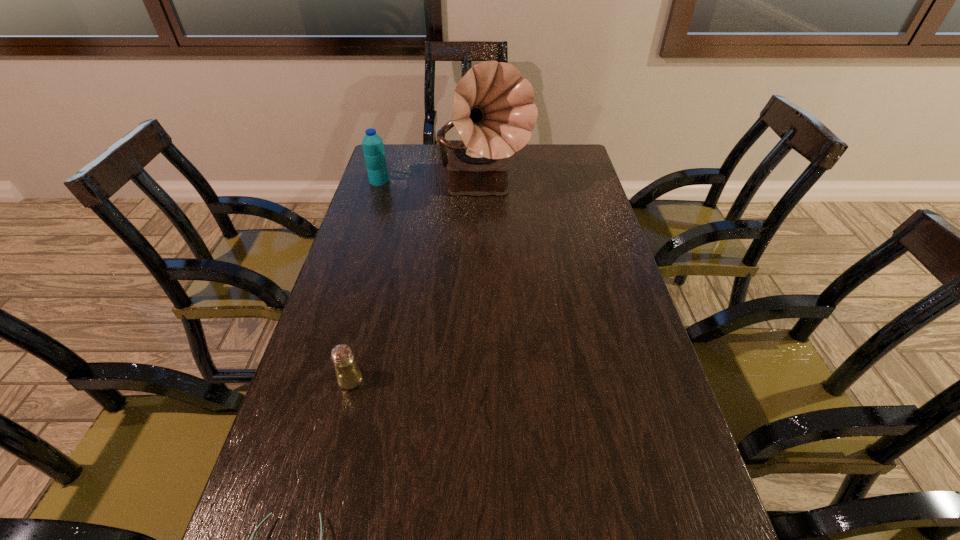
Locate which object ranks third in proximity to the second shortest object. Please provide its 2D coordinates. Your answer should be formatted as a tuple, i.e. [(x, y)], where the tuple contains the x and y coordinates of a point satisfying the conditions above.

[(373, 148)]

Where is `vacant region that satisfies the following two spatial constraints: 1. on the front side of the water bottle; 2. on the left side of the second nearest object`? vacant region that satisfies the following two spatial constraints: 1. on the front side of the water bottle; 2. on the left side of the second nearest object is located at coordinates (315, 380).

Find the location of a particular element. This screenshot has height=540, width=960. blank space that satisfies the following two spatial constraints: 1. on the front side of the water bottle; 2. on the left side of the second shortest object is located at coordinates (315, 380).